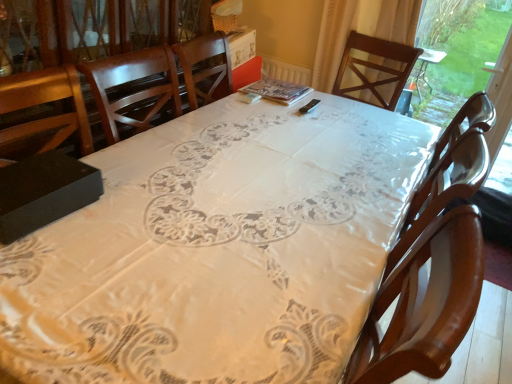
Question: Is white lace tablecloth at center further to the viewer compared to wooden chair at center?

Choices:
 (A) yes
 (B) no

Answer: (B)

Question: Is white lace tablecloth at center wider than wooden chair at center?

Choices:
 (A) no
 (B) yes

Answer: (B)

Question: From the image's perspective, would you say white lace tablecloth at center is positioned over wooden chair at center?

Choices:
 (A) no
 (B) yes

Answer: (A)

Question: Is white lace tablecloth at center closer to the viewer compared to wooden chair at center?

Choices:
 (A) yes
 (B) no

Answer: (A)

Question: Considering the relative sizes of white lace tablecloth at center and wooden chair at center in the image provided, is white lace tablecloth at center taller than wooden chair at center?

Choices:
 (A) no
 (B) yes

Answer: (B)

Question: Is wooden chair at center in front of or behind transparent plastic window screen at right in the image?

Choices:
 (A) behind
 (B) front

Answer: (B)

Question: Is point coord(415,304) positioned closer to the camera than point coord(509,165)?

Choices:
 (A) farther
 (B) closer

Answer: (B)

Question: Is wooden chair at center taller or shorter than transparent plastic window screen at right?

Choices:
 (A) short
 (B) tall

Answer: (A)

Question: From a real-world perspective, is wooden chair at center above or below transparent plastic window screen at right?

Choices:
 (A) below
 (B) above

Answer: (A)

Question: From a real-world perspective, is black matte box at lower left physically located above or below transparent plastic window screen at right?

Choices:
 (A) above
 (B) below

Answer: (A)

Question: Looking at their shapes, would you say black matte box at lower left is wider or thinner than transparent plastic window screen at right?

Choices:
 (A) thin
 (B) wide

Answer: (B)

Question: Do you think black matte box at lower left is within transparent plastic window screen at right, or outside of it?

Choices:
 (A) outside
 (B) inside

Answer: (A)

Question: From their relative heights in the image, would you say black matte box at lower left is taller or shorter than transparent plastic window screen at right?

Choices:
 (A) short
 (B) tall

Answer: (A)

Question: Is white lace tablecloth at center taller or shorter than black matte box at lower left?

Choices:
 (A) tall
 (B) short

Answer: (A)

Question: Considering the positions of point (76, 281) and point (74, 165), is point (76, 281) closer or farther from the camera than point (74, 165)?

Choices:
 (A) farther
 (B) closer

Answer: (B)